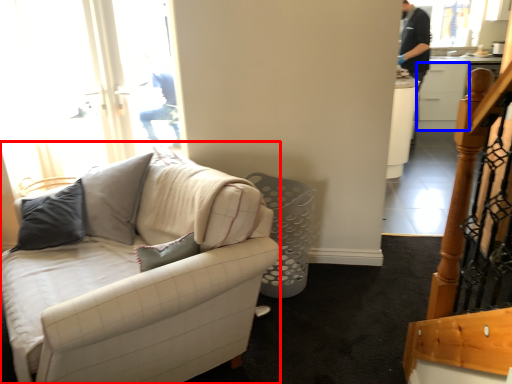
Question: Which of the following is the farthest to the observer, studio couch (highlighted by a red box) or cabinetry (highlighted by a blue box)?

Choices:
 (A) studio couch
 (B) cabinetry

Answer: (B)